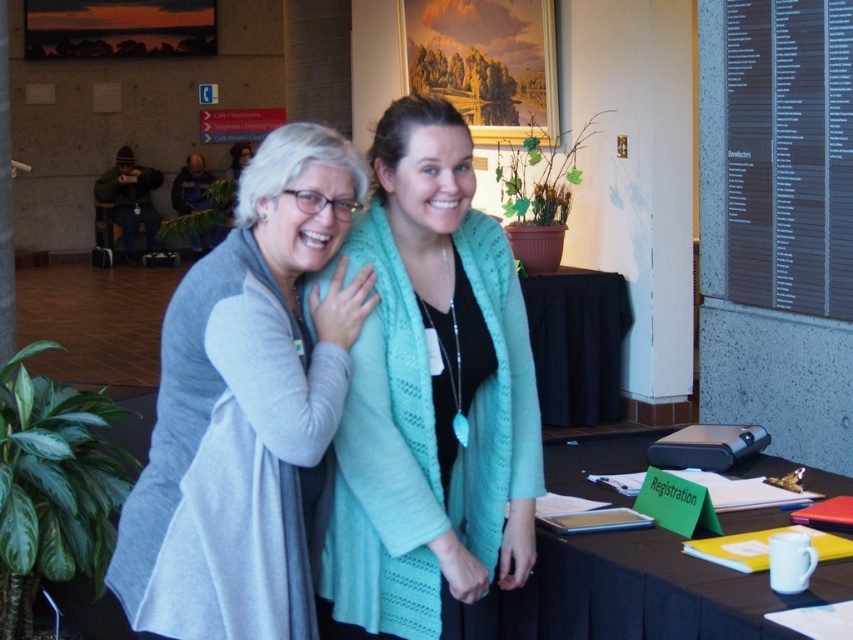
Does point (456, 449) come behind point (535, 346)?

That is False.

Who is more distant from viewer, (456, 506) or (554, 387)?

The point (554, 387) is more distant.

Image resolution: width=853 pixels, height=640 pixels. What are the coordinates of `teal knitted cardigan at center` in the screenshot? It's located at (432, 401).

You are a GUI agent. You are given a task and a screenshot of the screen. Output one action in this format:
    pyautogui.click(x=<x>, y=<y>)
    Task: Click on the teal knitted cardigan at center
    
    Given the screenshot: What is the action you would take?
    pyautogui.click(x=432, y=401)

Between point (231, 564) and point (593, 307), which one is positioned behind?

The point (593, 307) is behind.

Does gray soft sweater at center have a greater height compared to black fabric table at center?

No.

Image resolution: width=853 pixels, height=640 pixels. Find the location of `gray soft sweater at center`. gray soft sweater at center is located at coordinates (248, 408).

Between teal knitted cardigan at center and gray soft sweater at center, which one has more height?

teal knitted cardigan at center is taller.

Does teal knitted cardigan at center have a lesser width compared to gray soft sweater at center?

Indeed, teal knitted cardigan at center has a lesser width compared to gray soft sweater at center.

Where is `teal knitted cardigan at center`? This screenshot has height=640, width=853. teal knitted cardigan at center is located at coordinates (432, 401).

Find the location of a particular element. teal knitted cardigan at center is located at coordinates (432, 401).